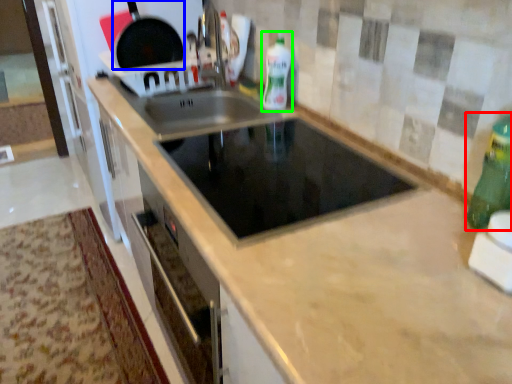
Question: Which object is positioned farthest from bottle (highlighted by a red box)? Select from frying pan (highlighted by a blue box) and bottle (highlighted by a green box).

Choices:
 (A) frying pan
 (B) bottle

Answer: (A)